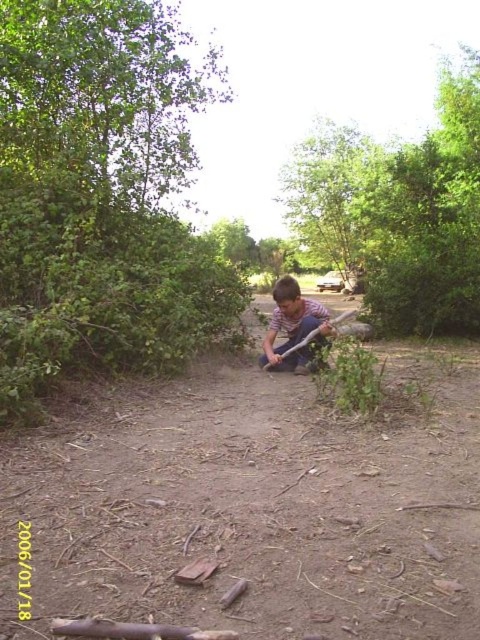
Question: In this image, where is green leafy tree at upper center located relative to striped shirt at center?

Choices:
 (A) left
 (B) right

Answer: (B)

Question: Which of the following is the closest to the observer?

Choices:
 (A) brown dirt path at center
 (B) green leafy bush at upper left

Answer: (A)

Question: Is brown dirt path at center bigger than green leafy tree at upper center?

Choices:
 (A) yes
 (B) no

Answer: (B)

Question: Which point is farther to the camera?

Choices:
 (A) (437, 365)
 (B) (69, 272)
 (C) (285, 360)

Answer: (A)

Question: Estimate the real-world distances between objects in this image. Which object is farther from the green leafy tree at upper center?

Choices:
 (A) green leafy bush at upper left
 (B) striped shirt at center

Answer: (B)

Question: Is green leafy bush at upper left to the left of striped shirt at center from the viewer's perspective?

Choices:
 (A) yes
 (B) no

Answer: (A)